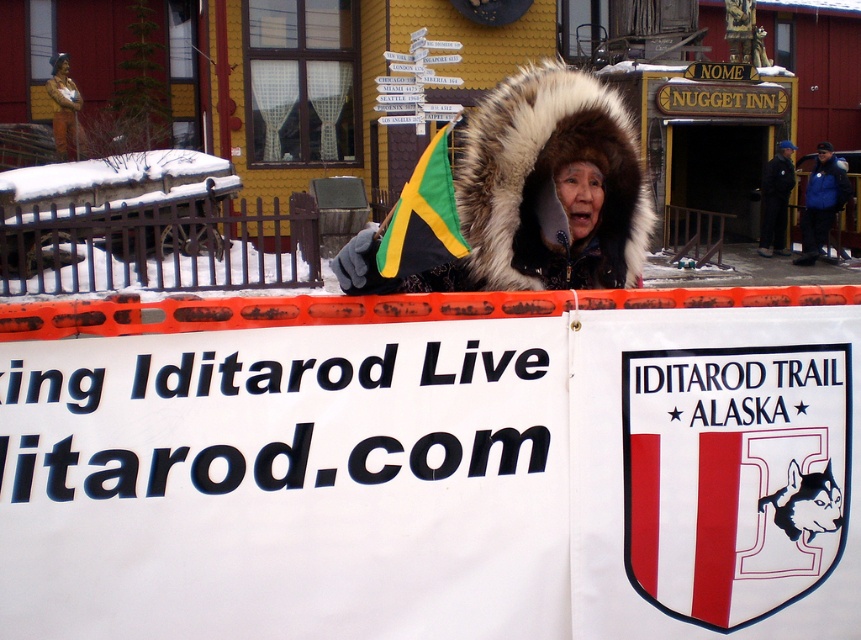
You are a photographer standing at the center of the event area. You want to capture a photo of the white paper sign at center without any obstructions. Based on the coordinates provided, is there enough space between you and the sign to avoid any objects in between?

The white paper sign at center is located at coordinates point (286, 483). Since there are no other objects mentioned between you and the sign, there should be enough space to capture the photo without obstructions.

You are a photographer positioned at the matte bronze statue at upper left and want to take a photo of the white paper sign at center. Given that your camera has a maximum focus range of 60 feet, will you be able to capture a clear image of the sign without moving closer?

The distance between the white paper sign at center and the matte bronze statue at upper left is 60.62 feet, which exceeds the camera maximum focus range of 60 feet. Therefore, you will not be able to capture a clear image of the white paper sign at center without moving closer.

You are attending the Iditarod event and see two coats available for rent. The fuzzy white fur coat at center and the blue fleece jacket at upper right. Which coat is covering the other one?

The fuzzy white fur coat at center is positioned over the blue fleece jacket at upper right, so it is covering the jacket.